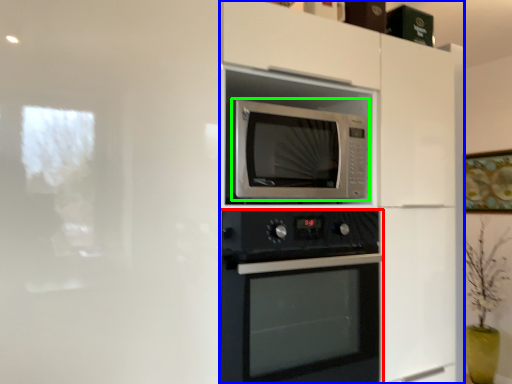
Question: Based on their relative distances, which object is nearer to oven (highlighted by a red box)? Choose from dresser (highlighted by a blue box) and microwave oven (highlighted by a green box).

Choices:
 (A) dresser
 (B) microwave oven

Answer: (B)